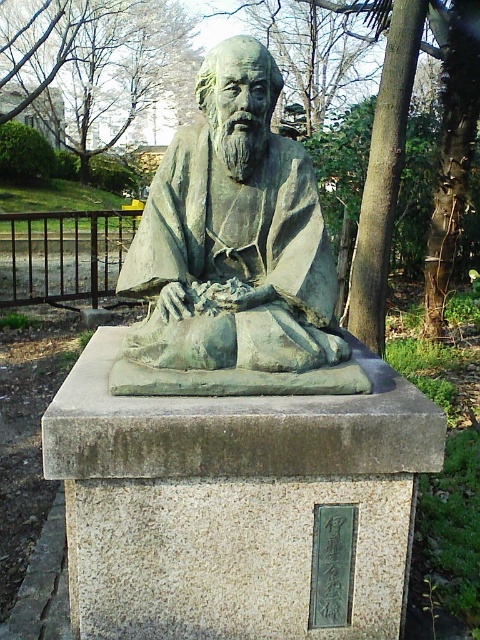
You are standing in front of the statue and want to take a photo of it. The statue is at point (233, 252). Where should you position yourself to ensure the statue is centered in your camera viewfinder?

The statue is located at point (233, 252), so you should position yourself directly in front of that point to center it in your camera viewfinder.

You are a visitor at a park and see the green patina statue at center and the green leafy tree at upper left. Which object is providing shade to the other?

The green leafy tree at upper left is providing shade to the green patina statue at center because the statue is positioned under the tree.